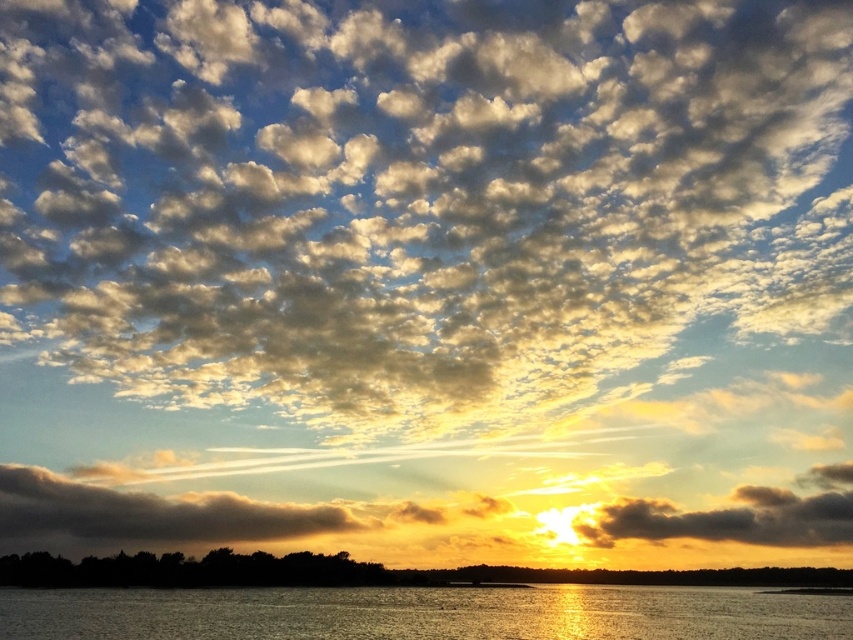
Is point (399, 628) closer to camera compared to point (630, 515)?

Yes, it is.

Can you confirm if glistening silver water at lower center is smaller than dark gray fluffy cloud at lower right?

No.

Describe the element at coordinates (422, 612) in the screenshot. I see `glistening silver water at lower center` at that location.

Find the location of `glistening silver water at lower center`. glistening silver water at lower center is located at coordinates (422, 612).

Which of these two, cloudy sky at upper center or glistening silver water at lower center, stands shorter?

glistening silver water at lower center is shorter.

Does cloudy sky at upper center have a lesser width compared to glistening silver water at lower center?

Incorrect, cloudy sky at upper center's width is not less than glistening silver water at lower center's.

This screenshot has width=853, height=640. I want to click on cloudy sky at upper center, so click(412, 193).

Does cloudy sky at upper center have a greater height compared to dark gray fluffy cloud at lower right?

Correct, cloudy sky at upper center is much taller as dark gray fluffy cloud at lower right.

Is point (267, 88) behind point (834, 490)?

That is False.

The height and width of the screenshot is (640, 853). What are the coordinates of `cloudy sky at upper center` in the screenshot? It's located at (412, 193).